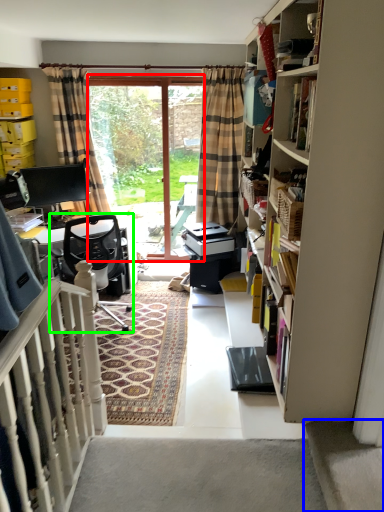
Question: Which object is positioned closest to screen door (highlighted by a red box)? Select from stairwell (highlighted by a blue box) and chair (highlighted by a green box).

Choices:
 (A) stairwell
 (B) chair

Answer: (B)